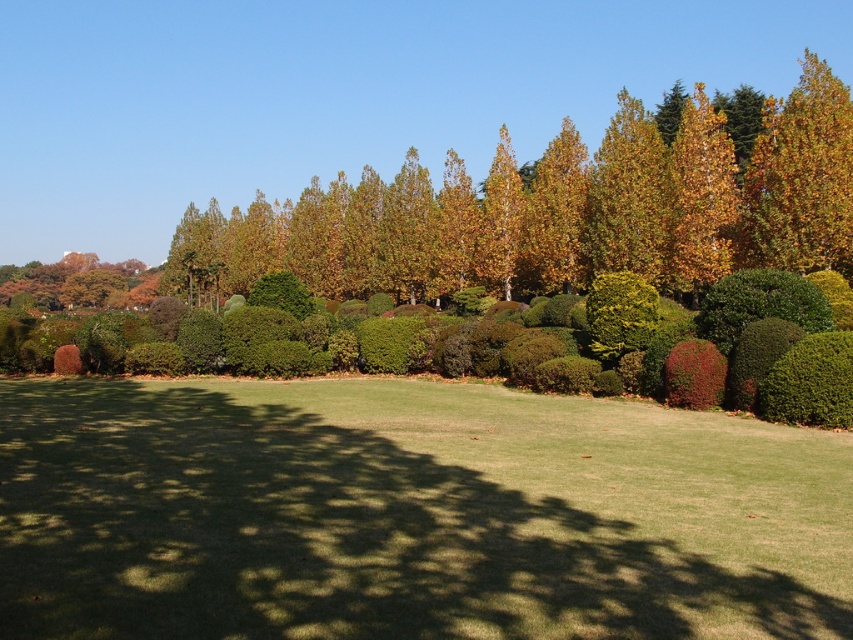
Question: In this image, where is golden yellow leaves at upper right located relative to yellow-green foliage at upper right?

Choices:
 (A) below
 (B) above

Answer: (B)

Question: Is the position of golden yellow leaves at upper center more distant than that of yellow-green foliage at upper right?

Choices:
 (A) no
 (B) yes

Answer: (A)

Question: Among these objects, which one is nearest to the camera?

Choices:
 (A) green grass at center
 (B) golden yellow leaves at upper right
 (C) yellow-green foliage at upper right
 (D) golden yellow leaves at upper center

Answer: (A)

Question: Considering the relative positions of golden yellow leaves at upper center and yellow-green foliage at upper right in the image provided, where is golden yellow leaves at upper center located with respect to yellow-green foliage at upper right?

Choices:
 (A) below
 (B) above

Answer: (A)

Question: Which of these objects is positioned closest to the yellow-green foliage at upper right?

Choices:
 (A) golden yellow leaves at upper center
 (B) green grass at center
 (C) golden yellow leaves at upper right

Answer: (C)

Question: Among these points, which one is nearest to the camera?

Choices:
 (A) (828, 218)
 (B) (665, 289)

Answer: (A)